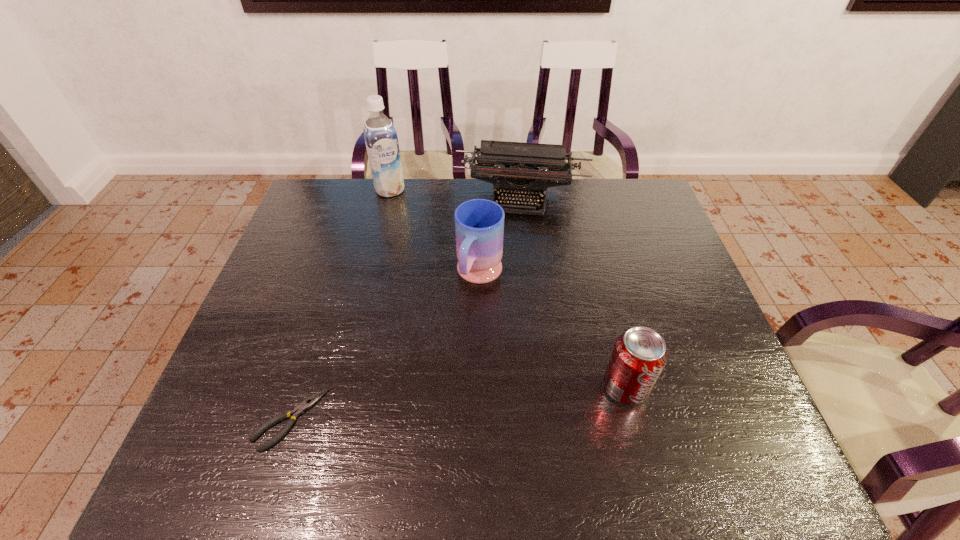
Where is `the shortest object`? The image size is (960, 540). the shortest object is located at coordinates (299, 410).

Where is `soda can`? This screenshot has height=540, width=960. soda can is located at coordinates (639, 356).

Where is `soya milk`? This screenshot has height=540, width=960. soya milk is located at coordinates (381, 139).

Find the location of a particular element. mug is located at coordinates (479, 223).

Image resolution: width=960 pixels, height=540 pixels. Identify the location of typewriter. (510, 166).

I want to click on vacant space located 0.260m on the back of the pliers, so click(x=329, y=298).

This screenshot has width=960, height=540. I want to click on vacant area located on the back of the soda can, so click(x=608, y=319).

Find the location of a particular element. This screenshot has width=960, height=540. vacant area situated 0.380m on the label of the tallest object is located at coordinates (428, 276).

Locate an element on the screen. The image size is (960, 540). vacant space located 0.090m on the label of the tallest object is located at coordinates (400, 214).

Find the location of a particular element. free space located 0.390m on the label of the tallest object is located at coordinates [429, 279].